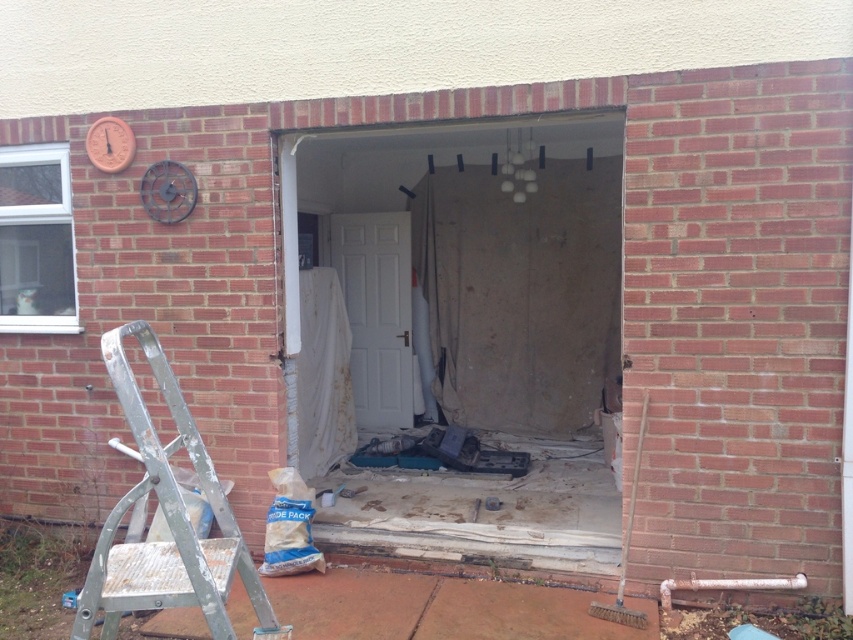
You are a delivery person trying to enter the building through the white matte door at center. There is a silver metallic ladder at left in your way. Can you walk around the ladder to reach the door?

The silver metallic ladder at left is closer to the viewer than the white matte door at center, so you can walk around the ladder to reach the white matte door at center.

You are a painter who needs to access a high area in the room. You see a silver metallic ladder at left and a white matte door at center. Which object is narrower and better suited for moving through tight spaces?

The silver metallic ladder at left is narrower than the white matte door at center, making it better suited for moving through tight spaces.

You are a delivery person carrying a package that requires a clear path to the white matte door at center. There is a silver metallic ladder at left in the way. Given that your delivery cart is 3 feet wide, can you navigate around the ladder to reach the door?

The silver metallic ladder at left is 14.51 feet away from the white matte door at center. Since the distance between them is much larger than the cart width of 3 feet, you can easily navigate around the ladder to reach the door.